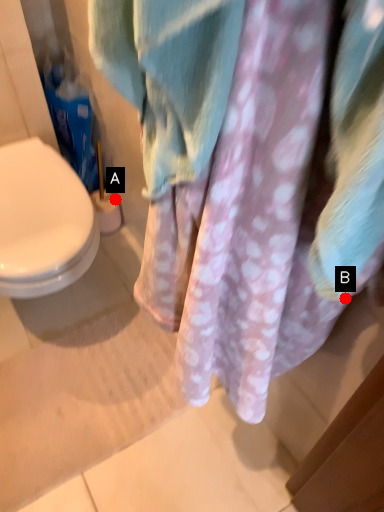
Question: Two points are circled on the image, labeled by A and B beside each circle. Which point is farther to the camera?

Choices:
 (A) A is further
 (B) B is further

Answer: (A)